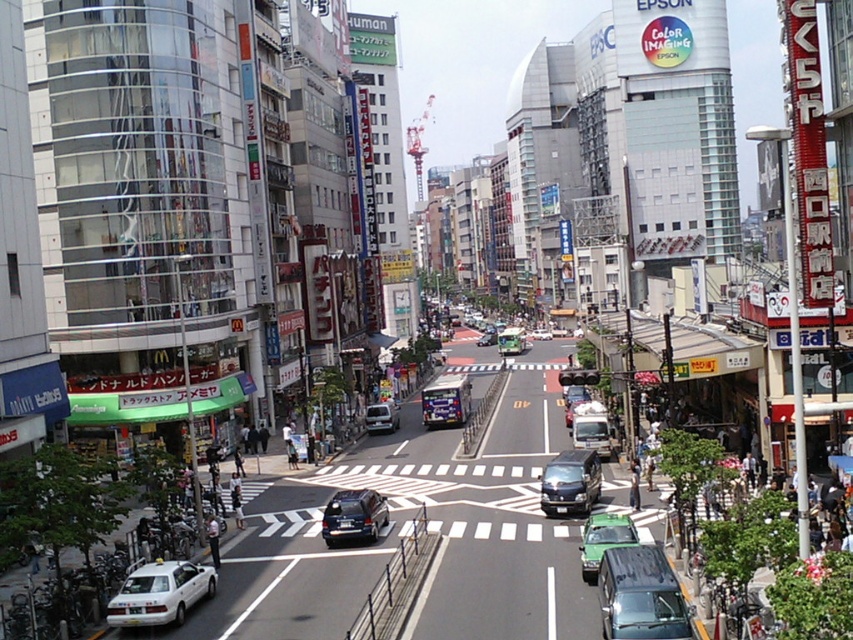
You are a delivery driver needing to park your vehicle in this street. You have a delivery van that is 4 meters long. The shiny black sedan at center and the green matte car at center are blocking the parking spot. Can you fit your van between them?

The shiny black sedan at center occupies less space than green matte car at center. Since the combined space between them is not specified, but the sedan takes up less space, it might leave enough room for your 4m van. However, without exact measurements, it is uncertain. Check the available space carefully before proceeding.

You are a pedestrian standing on the bridge overlooking the street. You see a shiny black sedan at center and a green matte car at center. Which car is closer to you?

The shiny black sedan at center is closer to you because it is positioned further to the viewer than the green matte car at center.

You are a delivery driver needing to park your vehicle in a spot that is exactly 16 meters away from the shiny black van at center. Can you use the white matte taxi at lower left as a reference point?

The white matte taxi at lower left is 16.05 meters from the shiny black van at center, so yes, you can use the white matte taxi at lower left as a reference point since it is approximately 16 meters away.